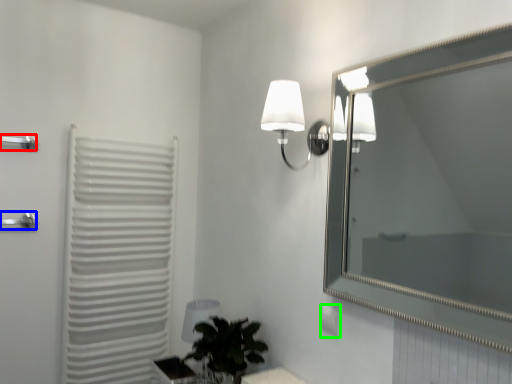
Question: Which is nearer to the towel bar (highlighted by a red box)? shower (highlighted by a blue box) or electric outlet (highlighted by a green box).

Choices:
 (A) shower
 (B) electric outlet

Answer: (A)